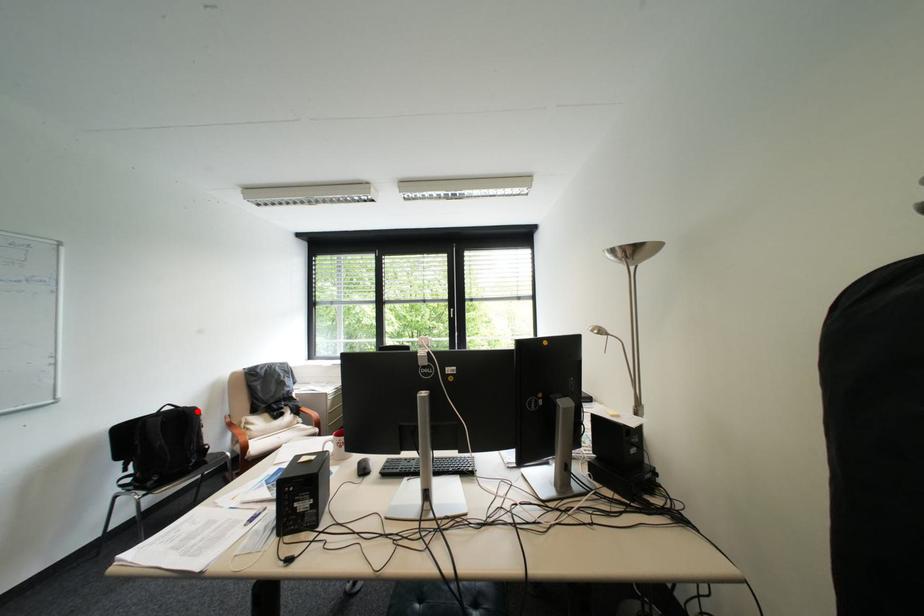
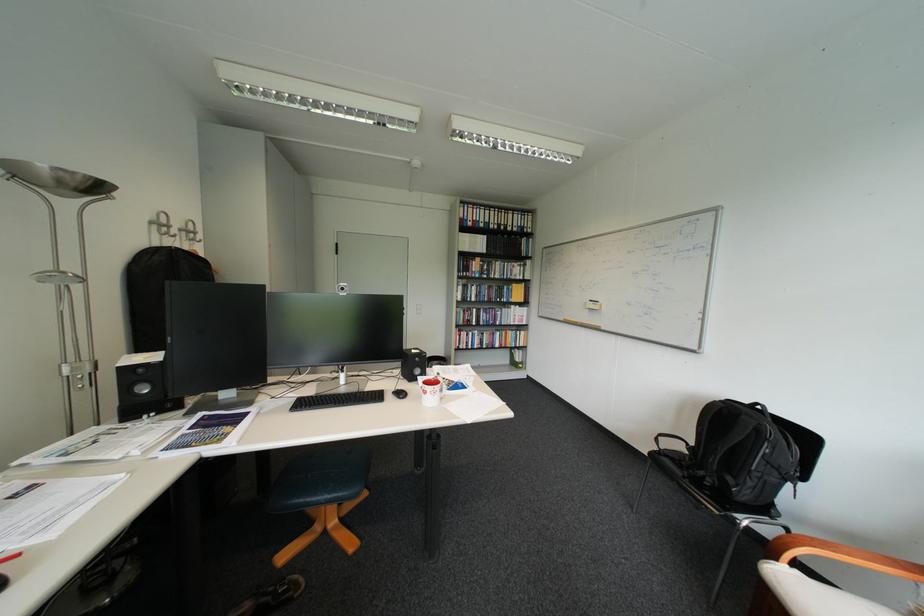
Find the pixel in the second image that matches the highlighted location in the first image.

(756, 418)